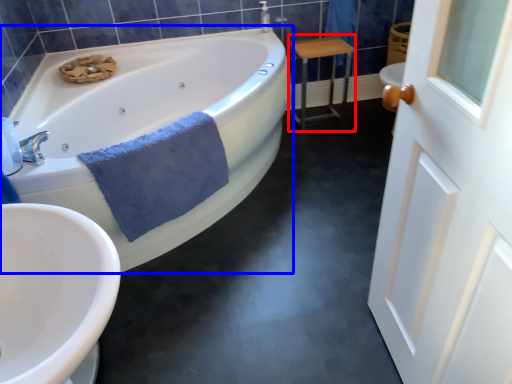
Question: Which object is further to the camera taking this photo, table (highlighted by a red box) or bathtub (highlighted by a blue box)?

Choices:
 (A) table
 (B) bathtub

Answer: (A)